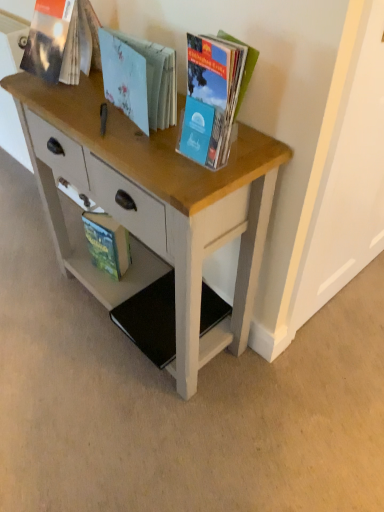
I want to click on free location to the right of matte plastic book at upper right, the fourth book from the back, so click(255, 151).